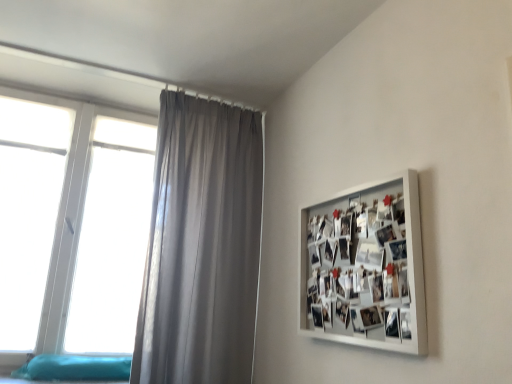
Question: Considering the positions of white matte picture frame at upper right and teal fabric bed at lower left in the image, is white matte picture frame at upper right bigger or smaller than teal fabric bed at lower left?

Choices:
 (A) small
 (B) big

Answer: (B)

Question: In the image, is white matte picture frame at upper right on the left side or the right side of teal fabric bed at lower left?

Choices:
 (A) right
 (B) left

Answer: (A)

Question: Which is nearer to the white matte picture frame at upper right?

Choices:
 (A) satin gray curtain at upper left
 (B) white plastic window at left
 (C) teal fabric bed at lower left

Answer: (A)

Question: Which of these objects is positioned farthest from the white plastic window at left?

Choices:
 (A) teal fabric bed at lower left
 (B) white matte picture frame at upper right
 (C) satin gray curtain at upper left

Answer: (B)